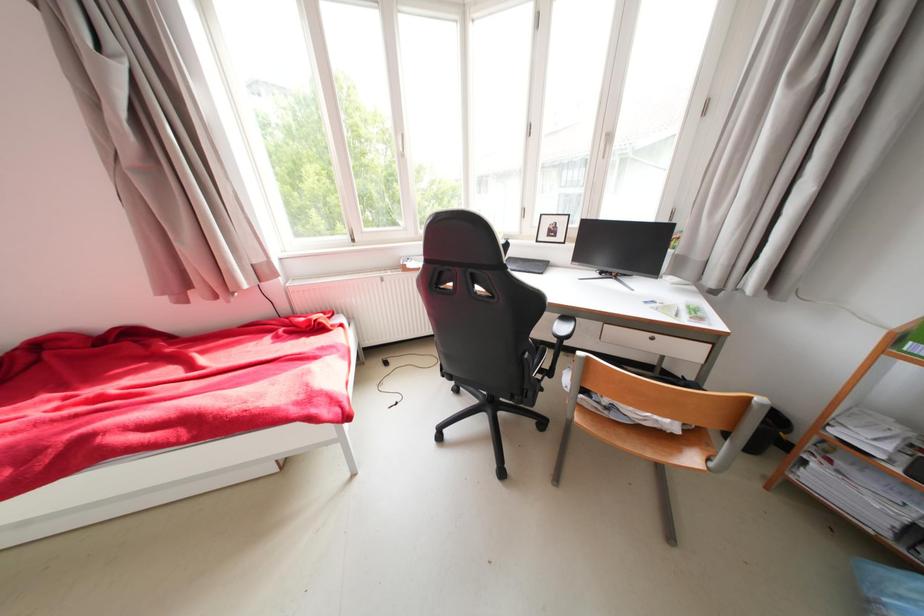
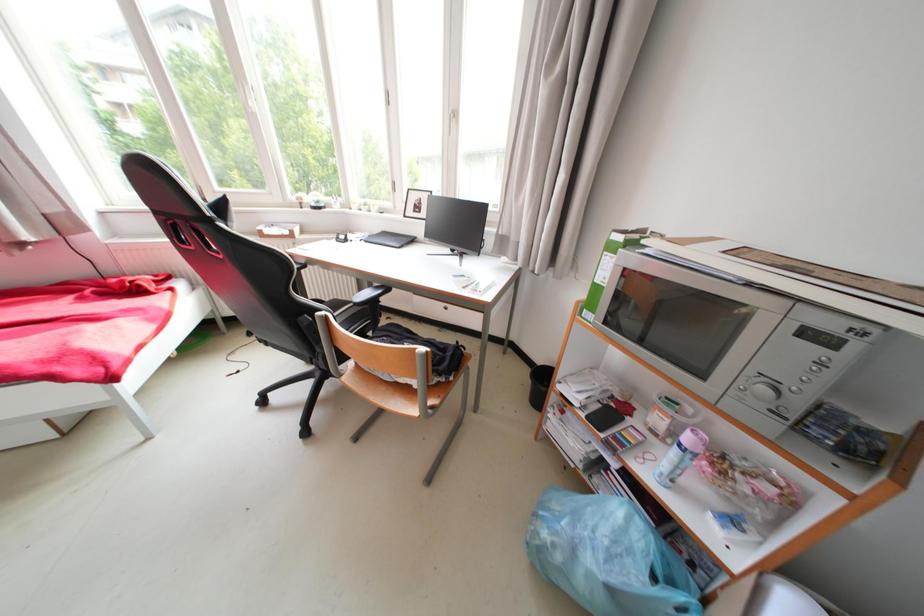
Question: The first image is from the beginning of the video and the second image is from the end. How did the camera likely rotate when shooting the video?

Choices:
 (A) Left
 (B) Right
 (C) Up
 (D) Down

Answer: (B)